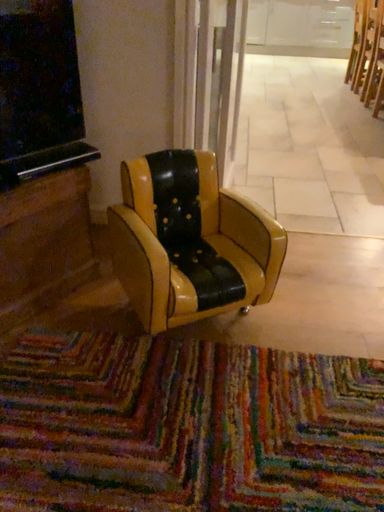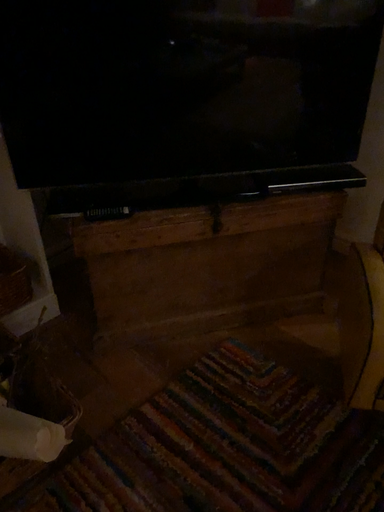
Question: Which way did the camera rotate in the video?

Choices:
 (A) rotated downward
 (B) rotated upward

Answer: (B)